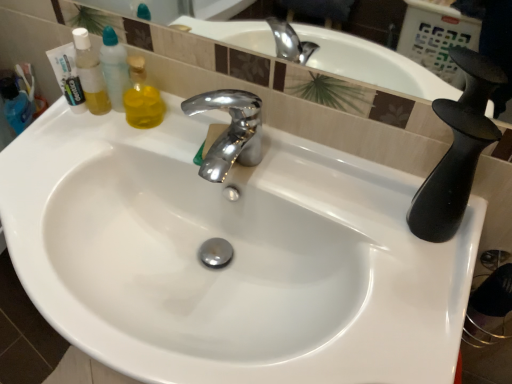
Find the location of a particular element. vacant area that lies to the right of polished chrome faucet at center is located at coordinates (293, 171).